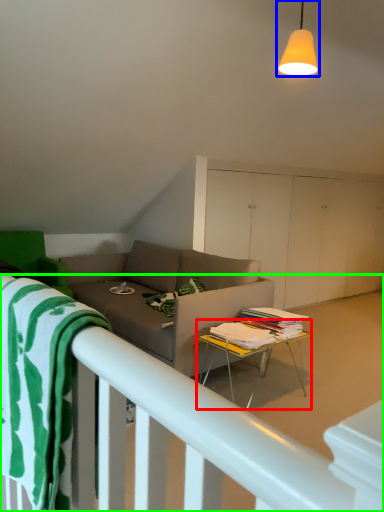
Question: Estimate the real-world distances between objects in this image. Which object is closer to table (highlighted by a red box), light fixture (highlighted by a blue box) or bed frame (highlighted by a green box)?

Choices:
 (A) light fixture
 (B) bed frame

Answer: (A)